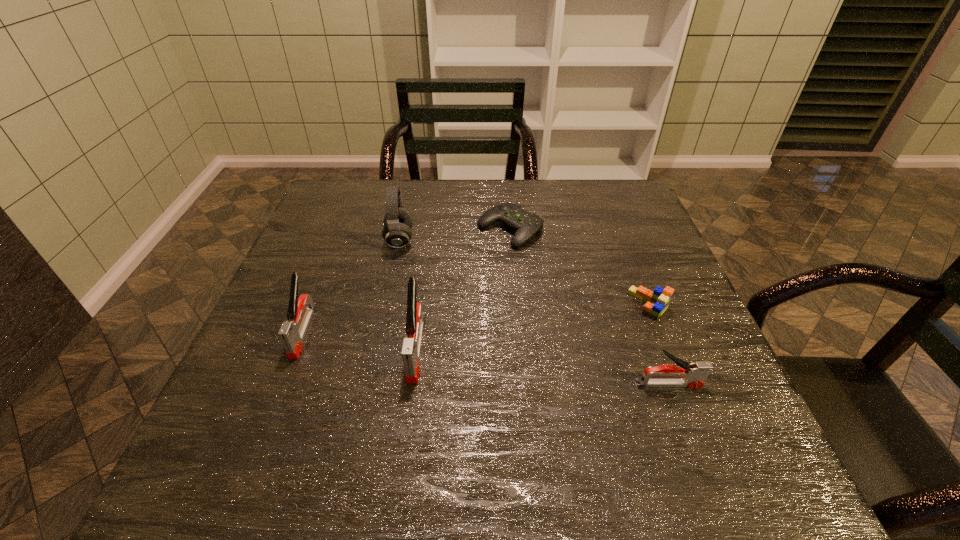
At what (x,y) coordinates should I click in order to perform the action: click on vacant space located 0.070m on the handle side of the third object from left to right. Please return your answer as a coordinate pair (x, y). The image size is (960, 540). Looking at the image, I should click on (407, 416).

At what (x,y) coordinates should I click in order to perform the action: click on vacant space situated 0.230m on the ear cups of the fifth object from right to left. Please return your answer as a coordinate pair (x, y). Image resolution: width=960 pixels, height=540 pixels. Looking at the image, I should click on (500, 240).

The image size is (960, 540). I want to click on free region located on the front of the Lego, so click(695, 420).

You are a GUI agent. You are given a task and a screenshot of the screen. Output one action in this format:
    pyautogui.click(x=<x>, y=<y>)
    Task: Click on the free location located on the left of the shortest object
    The image size is (960, 540).
    Given the screenshot: What is the action you would take?
    pyautogui.click(x=426, y=230)

Find the location of `object that is at the far edge`. object that is at the far edge is located at coordinates (526, 224).

This screenshot has height=540, width=960. In order to click on object present at the left edge in this screenshot , I will do `click(292, 332)`.

Locate an element on the screen. stapler located at the right edge is located at coordinates (694, 375).

At what (x,y) coordinates should I click in order to perform the action: click on Lego present at the right edge. Please return your answer as a coordinate pair (x, y). The image size is (960, 540). Looking at the image, I should click on (657, 301).

The height and width of the screenshot is (540, 960). In the image, there is a desktop. In order to click on vacant space at the far edge in this screenshot , I will do `click(554, 182)`.

In order to click on free region at the near edge of the desktop in this screenshot , I will do `click(596, 404)`.